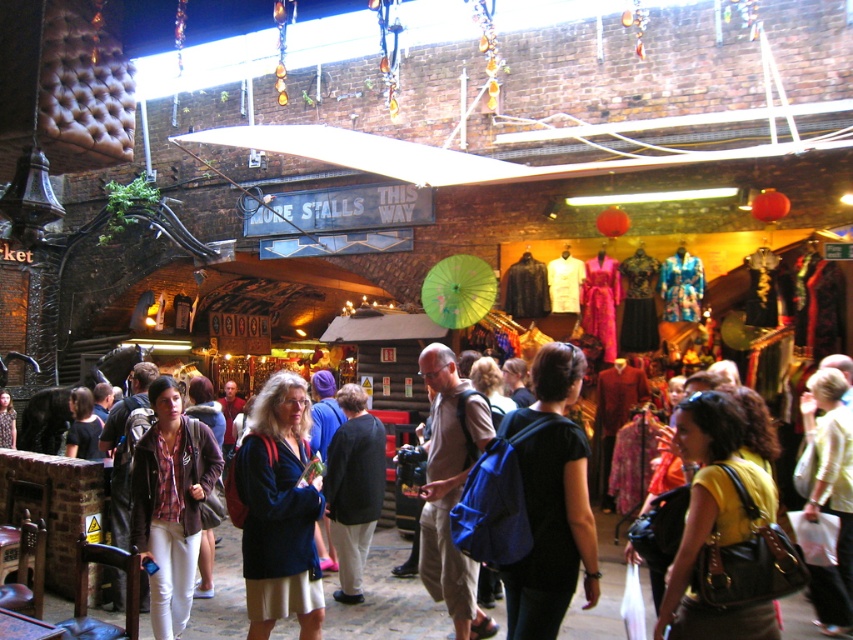
From the picture: You are a vendor at the market and need to display two items on a shelf. The shelf has limited vertical space, and you want to ensure both items are visible. Given the yellow fabric bag at center and the matte black jacket at center, which item should you place lower on the shelf to accommodate their sizes?

The yellow fabric bag at center is taller than the matte black jacket at center, so you should place the yellow fabric bag at center lower on the shelf to ensure both items are visible without overcrowding the vertical space.

You are a customer in the market and want to buy the yellow matte shirt at center. The market has a rule that items displayed at the center are for VIP customers only. However, you notice a point marked at coordinates (715, 518). Can you determine if the yellow matte shirt at center is accessible to regular customers based on this point?

The point (715, 518) is on the yellow matte shirt at center, so the shirt is accessible to regular customers because the marked point indicates it is part of the regular display area.